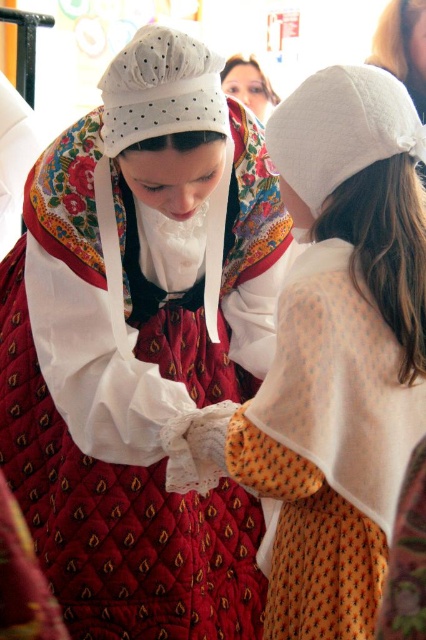
Is point (339, 436) closer to viewer compared to point (382, 61)?

That is True.

Locate an element on the screen. The height and width of the screenshot is (640, 426). white cotton bonnet at upper center is located at coordinates (340, 352).

This screenshot has height=640, width=426. Find the location of `white cotton bonnet at upper center`. white cotton bonnet at upper center is located at coordinates (340, 352).

Does white cotton cap at upper center have a lesser height compared to matte white lace at upper center?

Incorrect, white cotton cap at upper center's height does not fall short of matte white lace at upper center's.

Who is more forward, [403,77] or [250,58]?

Positioned in front is point [403,77].

You are a GUI agent. You are given a task and a screenshot of the screen. Output one action in this format:
    pyautogui.click(x=<x>, y=<y>)
    Task: Click on the white cotton cap at upper center
    The image size is (426, 640).
    Given the screenshot: What is the action you would take?
    pyautogui.click(x=402, y=45)

Between quilted red dress at center and matte white lace at upper center, which one has more height?

Standing taller between the two is quilted red dress at center.

You are a GUI agent. You are given a task and a screenshot of the screen. Output one action in this format:
    pyautogui.click(x=<x>, y=<y>)
    Task: Click on the quilted red dress at center
    The width and height of the screenshot is (426, 640).
    Given the screenshot: What is the action you would take?
    pyautogui.click(x=141, y=348)

Is point (109, 193) positioned before point (230, 84)?

Yes, point (109, 193) is in front of point (230, 84).

Locate an element on the screen. The height and width of the screenshot is (640, 426). quilted red dress at center is located at coordinates (141, 348).